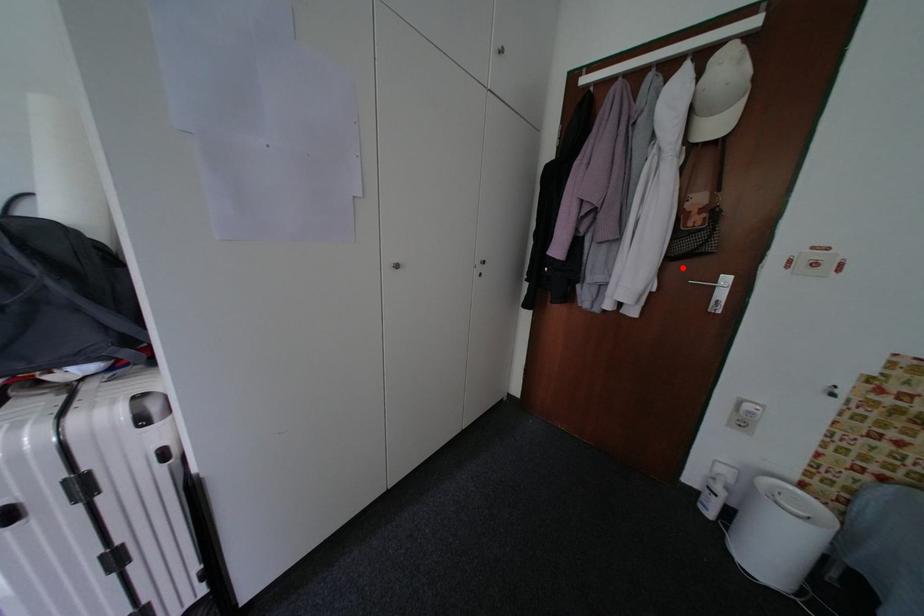
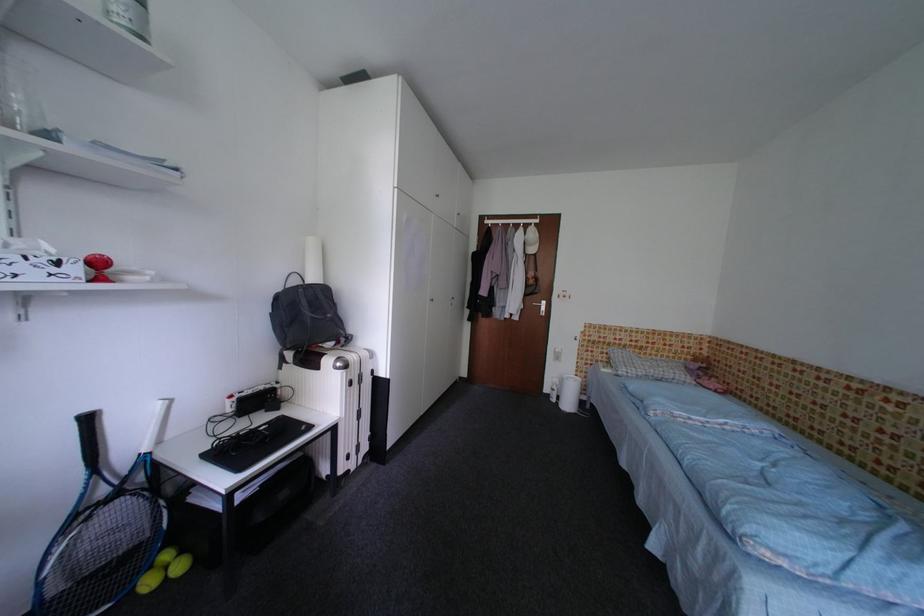
Where in the second image is the point corresponding to the highlighted location from the first image?

(536, 300)